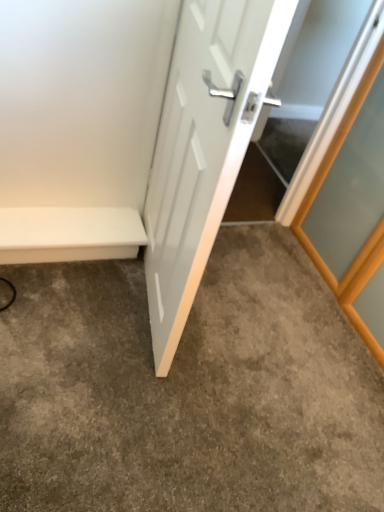
Where is `free area in between white glossy door at center and white matte bench at lower left`? free area in between white glossy door at center and white matte bench at lower left is located at coordinates (86, 303).